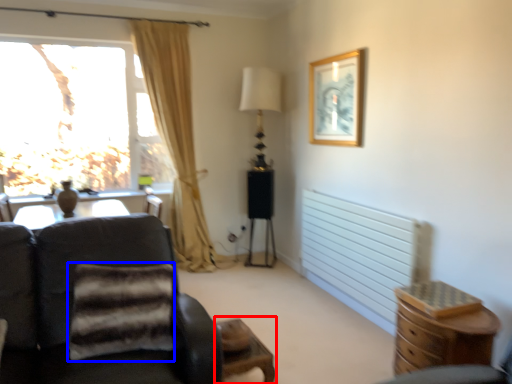
Question: Which object appears closest to the camera in this image, side table (highlighted by a red box) or pillow (highlighted by a blue box)?

Choices:
 (A) side table
 (B) pillow

Answer: (B)